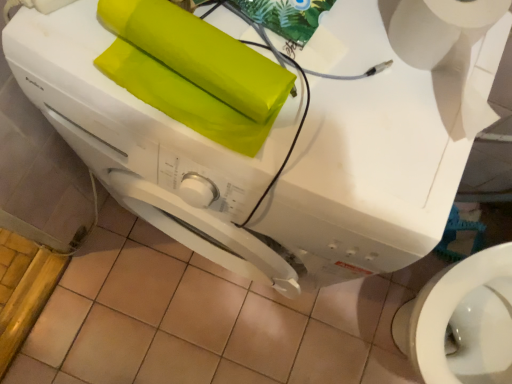
Identify the location of vacant space in front of white matte toilet paper at upper right. [x=379, y=159].